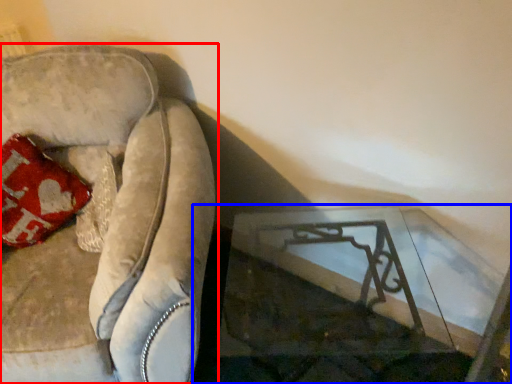
Question: Which point is closer to the camera, furniture (highlighted by a red box) or table (highlighted by a blue box)?

Choices:
 (A) furniture
 (B) table

Answer: (B)